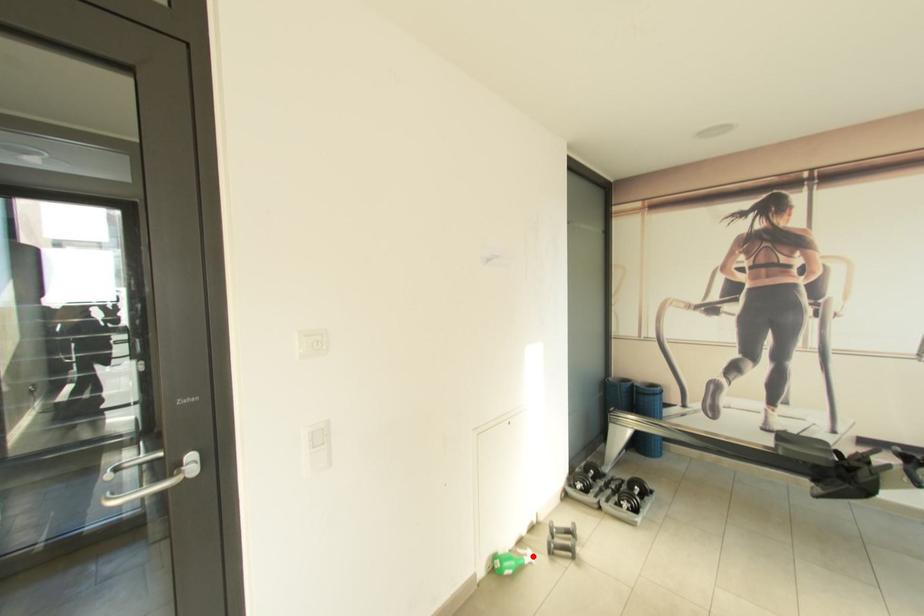
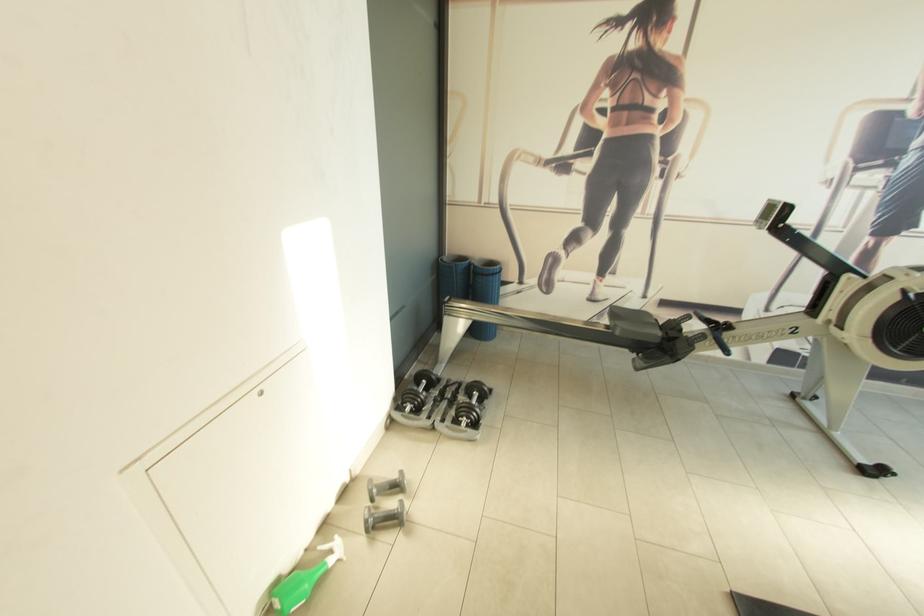
In the second image, find the point that corresponds to the highlighted location in the first image.

(339, 551)